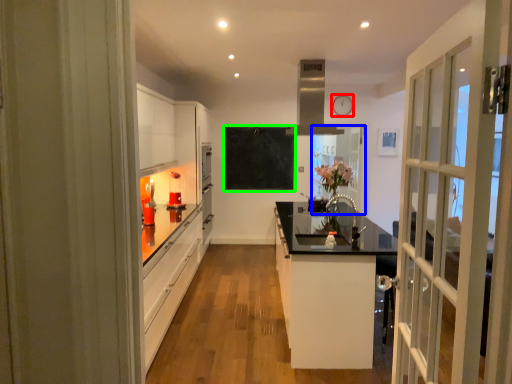
Question: Estimate the real-world distances between objects in this image. Which object is closer to clock (highlighted by a red box), window (highlighted by a blue box) or bulletin board (highlighted by a green box)?

Choices:
 (A) window
 (B) bulletin board

Answer: (A)